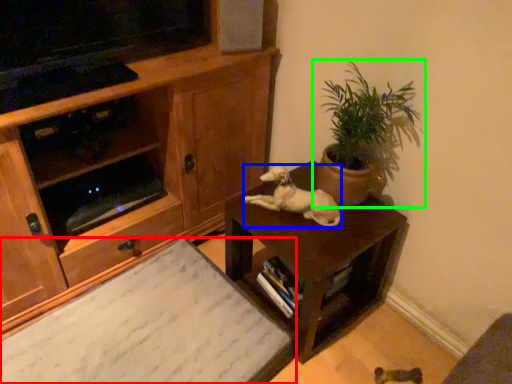
Question: Which is nearer to the desk (highlighted by a red box)? animal (highlighted by a blue box) or houseplant (highlighted by a green box).

Choices:
 (A) animal
 (B) houseplant

Answer: (A)